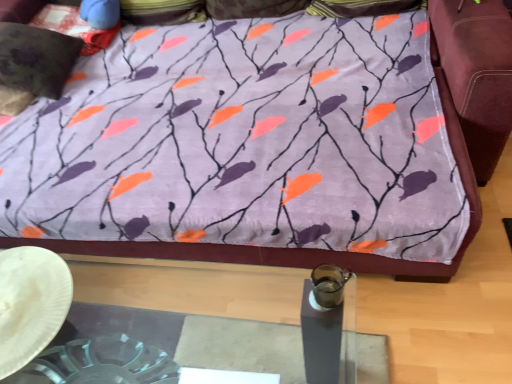
What do you see at coordinates (162, 11) in the screenshot? I see `purple fabric pillow at upper center, the first pillow when ordered from top to bottom` at bounding box center [162, 11].

At what (x,y) coordinates should I click in order to perform the action: click on velvety black pillow at upper left, the first pillow positioned from the bottom. Please return your answer as a coordinate pair (x, y). The width and height of the screenshot is (512, 384). Looking at the image, I should click on (36, 59).

This screenshot has height=384, width=512. I want to click on purple fabric bedspread at upper center, so click(x=270, y=166).

Where is `velvety dark brown pillow at upper left, marked as the 2th pillow in a bottom-to-top arrangement`? velvety dark brown pillow at upper left, marked as the 2th pillow in a bottom-to-top arrangement is located at coordinates (74, 27).

Between purple fabric bedspread at upper center and velvety dark brown pillow at upper left, which appears as the second pillow when viewed from the top, which one appears on the left side from the viewer's perspective?

velvety dark brown pillow at upper left, which appears as the second pillow when viewed from the top.

Is purple fabric bedspread at upper center facing towards velvety dark brown pillow at upper left, which appears as the second pillow when viewed from the top?

No, purple fabric bedspread at upper center is not aimed at velvety dark brown pillow at upper left, which appears as the second pillow when viewed from the top.

Based on their sizes in the image, would you say purple fabric bedspread at upper center is bigger or smaller than velvety dark brown pillow at upper left, marked as the 2th pillow in a bottom-to-top arrangement?

purple fabric bedspread at upper center is bigger than velvety dark brown pillow at upper left, marked as the 2th pillow in a bottom-to-top arrangement.

Which of these two, purple fabric bedspread at upper center or white paper plate at lower left, is smaller?

With smaller size is white paper plate at lower left.

Is purple fabric bedspread at upper center positioned beyond the bounds of white paper plate at lower left?

That's correct, purple fabric bedspread at upper center is outside of white paper plate at lower left.

Based on the photo, how different are the orientations of purple fabric bedspread at upper center and white paper plate at lower left in degrees?

The angular difference between purple fabric bedspread at upper center and white paper plate at lower left is 88 degrees.

Is the depth of velvety black pillow at upper left, which is counted as the 3th pillow, starting from the top, less than that of velvety dark brown pillow at upper left, marked as the 2th pillow in a bottom-to-top arrangement?

Yes, velvety black pillow at upper left, which is counted as the 3th pillow, starting from the top, is closer to the camera.

Locate an element on the screen. Image resolution: width=512 pixels, height=384 pixels. pillow that is under the velvety dark brown pillow at upper left, marked as the 2th pillow in a bottom-to-top arrangement (from a real-world perspective) is located at coordinates (36, 59).

Can you confirm if velvety black pillow at upper left, the first pillow positioned from the bottom, is bigger than velvety dark brown pillow at upper left, marked as the 2th pillow in a bottom-to-top arrangement?

Indeed, velvety black pillow at upper left, the first pillow positioned from the bottom, has a larger size compared to velvety dark brown pillow at upper left, marked as the 2th pillow in a bottom-to-top arrangement.

From the image's perspective, is velvety black pillow at upper left, which is counted as the 3th pillow, starting from the top, on velvety dark brown pillow at upper left, which appears as the second pillow when viewed from the top?

No, from the image's perspective, velvety black pillow at upper left, which is counted as the 3th pillow, starting from the top, is not above velvety dark brown pillow at upper left, which appears as the second pillow when viewed from the top.

From the picture: Can you confirm if purple fabric bedspread at upper center is thinner than purple fabric pillow at upper center, which appears as the 3th pillow when ordered from the bottom?

No, purple fabric bedspread at upper center is not thinner than purple fabric pillow at upper center, which appears as the 3th pillow when ordered from the bottom.

Does point (400, 210) appear closer or farther from the camera than point (195, 17)?

Point (400, 210) is positioned closer to the camera compared to point (195, 17).

Which of these two, purple fabric bedspread at upper center or purple fabric pillow at upper center, the first pillow when ordered from top to bottom, stands shorter?

With less height is purple fabric bedspread at upper center.

Is purple fabric bedspread at upper center oriented towards purple fabric pillow at upper center, which appears as the 3th pillow when ordered from the bottom?

No.

From a real-world perspective, which object stands above the other?

→ purple fabric pillow at upper center, the first pillow when ordered from top to bottom, from a real-world perspective.

Considering the sizes of purple fabric pillow at upper center, which appears as the 3th pillow when ordered from the bottom, and purple fabric bedspread at upper center in the image, is purple fabric pillow at upper center, which appears as the 3th pillow when ordered from the bottom, bigger or smaller than purple fabric bedspread at upper center?

Clearly, purple fabric pillow at upper center, which appears as the 3th pillow when ordered from the bottom, is smaller in size than purple fabric bedspread at upper center.

From the image's perspective, which one is positioned lower, purple fabric pillow at upper center, the first pillow when ordered from top to bottom, or purple fabric bedspread at upper center?

purple fabric bedspread at upper center is shown below in the image.

Considering the points (201, 16) and (0, 62), which point is in front, point (201, 16) or point (0, 62)?

Point (0, 62)

Could you tell me if purple fabric pillow at upper center, the first pillow when ordered from top to bottom, is facing velvety black pillow at upper left, the first pillow positioned from the bottom?

Yes, purple fabric pillow at upper center, the first pillow when ordered from top to bottom, is turned towards velvety black pillow at upper left, the first pillow positioned from the bottom.

Considering the relative sizes of purple fabric pillow at upper center, the first pillow when ordered from top to bottom, and velvety black pillow at upper left, the first pillow positioned from the bottom, in the image provided, is purple fabric pillow at upper center, the first pillow when ordered from top to bottom, shorter than velvety black pillow at upper left, the first pillow positioned from the bottom,?

Yes.

There is a white paper plate at lower left. Identify the location of the 1st pillow above it (from the image's perspective). (36, 59).

Is the position of velvety black pillow at upper left, the first pillow positioned from the bottom, less distant than that of white paper plate at lower left?

No.

Looking at this image, considering the sizes of objects velvety black pillow at upper left, the first pillow positioned from the bottom, and white paper plate at lower left in the image provided, who is smaller, velvety black pillow at upper left, the first pillow positioned from the bottom, or white paper plate at lower left?

Smaller between the two is white paper plate at lower left.

Image resolution: width=512 pixels, height=384 pixels. I want to click on the 2nd pillow above the purple fabric bedspread at upper center (from the image's perspective), so click(x=74, y=27).

What are the coordinates of `cowboy hat located above the purple fabric bedspread at upper center (from a real-world perspective)` in the screenshot? It's located at (30, 303).

Estimate the real-world distances between objects in this image. Which object is closer to velvety black pillow at upper left, the first pillow positioned from the bottom, purple fabric pillow at upper center, the first pillow when ordered from top to bottom, or velvety dark brown pillow at upper left, marked as the 2th pillow in a bottom-to-top arrangement?

velvety dark brown pillow at upper left, marked as the 2th pillow in a bottom-to-top arrangement, lies closer to velvety black pillow at upper left, the first pillow positioned from the bottom, than the other object.

Which object lies nearer to the anchor point white paper plate at lower left, velvety black pillow at upper left, the first pillow positioned from the bottom, or purple fabric pillow at upper center, the first pillow when ordered from top to bottom?

Among the two, velvety black pillow at upper left, the first pillow positioned from the bottom, is located nearer to white paper plate at lower left.

Which object lies further to the anchor point velvety black pillow at upper left, the first pillow positioned from the bottom, velvety dark brown pillow at upper left, marked as the 2th pillow in a bottom-to-top arrangement, or purple fabric pillow at upper center, the first pillow when ordered from top to bottom?

purple fabric pillow at upper center, the first pillow when ordered from top to bottom, lies further to velvety black pillow at upper left, the first pillow positioned from the bottom, than the other object.

Based on their spatial positions, is white paper plate at lower left or purple fabric bedspread at upper center closer to velvety dark brown pillow at upper left, which appears as the second pillow when viewed from the top?

purple fabric bedspread at upper center is closer to velvety dark brown pillow at upper left, which appears as the second pillow when viewed from the top.

Looking at the image, which one is located further to velvety black pillow at upper left, the first pillow positioned from the bottom, purple fabric pillow at upper center, the first pillow when ordered from top to bottom, or purple fabric bedspread at upper center?

purple fabric bedspread at upper center lies further to velvety black pillow at upper left, the first pillow positioned from the bottom, than the other object.

Based on their spatial positions, is purple fabric pillow at upper center, which appears as the 3th pillow when ordered from the bottom, or white paper plate at lower left further from velvety dark brown pillow at upper left, which appears as the second pillow when viewed from the top?

Among the two, white paper plate at lower left is located further to velvety dark brown pillow at upper left, which appears as the second pillow when viewed from the top.

When comparing their distances from white paper plate at lower left, does velvety dark brown pillow at upper left, which appears as the second pillow when viewed from the top, or purple fabric pillow at upper center, the first pillow when ordered from top to bottom, seem closer?

velvety dark brown pillow at upper left, which appears as the second pillow when viewed from the top, is positioned closer to the anchor white paper plate at lower left.

Based on their spatial positions, is velvety black pillow at upper left, the first pillow positioned from the bottom, or velvety dark brown pillow at upper left, which appears as the second pillow when viewed from the top, further from white paper plate at lower left?

velvety dark brown pillow at upper left, which appears as the second pillow when viewed from the top, is further to white paper plate at lower left.

Find the location of a particular element. This screenshot has height=384, width=512. furniture between purple fabric pillow at upper center, which appears as the 3th pillow when ordered from the bottom, and white paper plate at lower left, in the vertical direction is located at coordinates (270, 166).

The height and width of the screenshot is (384, 512). I want to click on furniture between velvety dark brown pillow at upper left, which appears as the second pillow when viewed from the top, and white paper plate at lower left from top to bottom, so click(x=270, y=166).

You are a GUI agent. You are given a task and a screenshot of the screen. Output one action in this format:
    pyautogui.click(x=<x>, y=<y>)
    Task: Click on the pillow between velvety dark brown pillow at upper left, marked as the 2th pillow in a bottom-to-top arrangement, and white paper plate at lower left in the up-down direction
    The width and height of the screenshot is (512, 384).
    Given the screenshot: What is the action you would take?
    pyautogui.click(x=36, y=59)

I want to click on cowboy hat between velvety black pillow at upper left, which is counted as the 3th pillow, starting from the top, and purple fabric bedspread at upper center, so click(x=30, y=303).